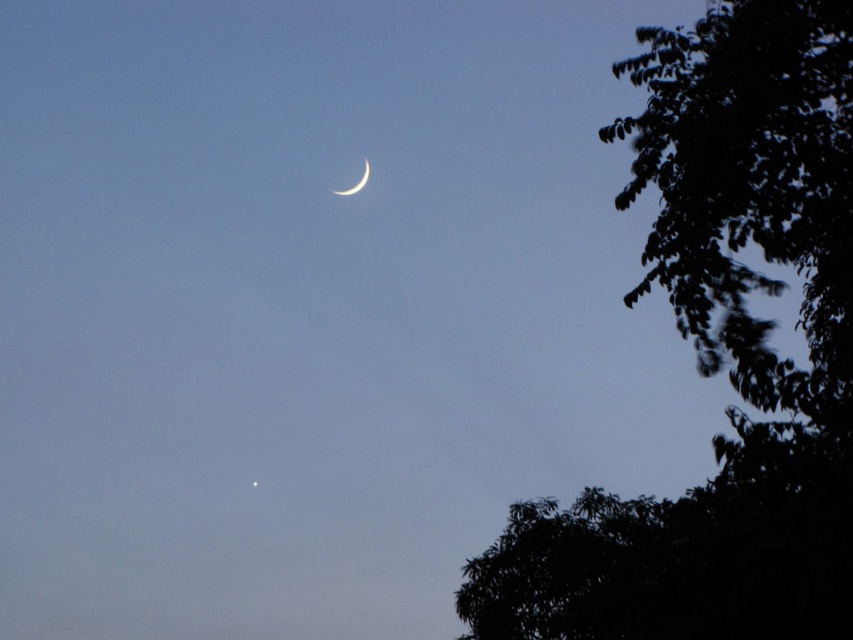
Does dark green leafy tree at upper right have a lesser width compared to satin silver crescent at upper center?

Incorrect, dark green leafy tree at upper right's width is not less than satin silver crescent at upper center's.

Is point (561, 547) behind point (341, 193)?

No, it is in front of (341, 193).

What are the coordinates of `dark green leafy tree at upper right` in the screenshot? It's located at (717, 355).